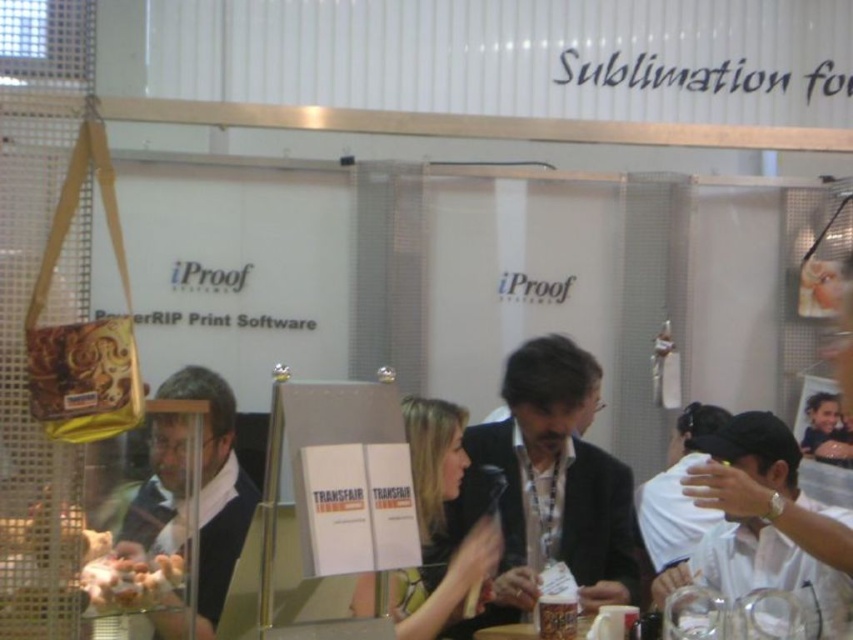
You are an event planner at the iProof booth and need to decide which item to place on the main display table. The table has limited space. Which item should you choose between the matte black suit at center and the matte black sweater at center based on their size?

The matte black suit at center is larger in size than the matte black sweater at center, so you should choose the matte black sweater at center to place on the main display table due to limited space.

You are a fashion designer observing the trade show booth. You notice the white fabric cap at upper right and the black fabric jacket at center. Which item has a shorter length?

The white fabric cap at upper right is shorter than the black fabric jacket at center.